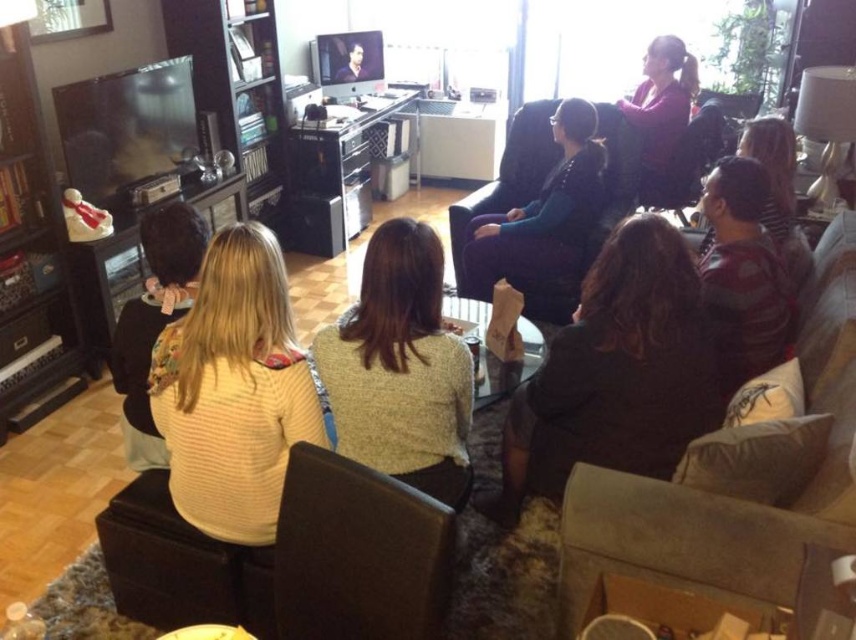
You are a guest at this gathering and want to hand a gift to the person wearing the yellow striped sweater at center and the pink fabric at upper right. Since you are standing at the entrance, which of the two items is closer to you?

The yellow striped sweater at center is closer to the viewer than the pink fabric at upper right, so you should hand the gift to the person wearing the yellow striped sweater at center first as they are nearer to you.

You are planning to host a guest who prefers seating with more width for comfort. Which chair between the dark brown leather armchair at center and the velvet dark purple armchair at center would you recommend?

The velvet dark purple armchair at center is wider than the dark brown leather armchair at center, so it would be more comfortable for the guest who prefers seating with more width.